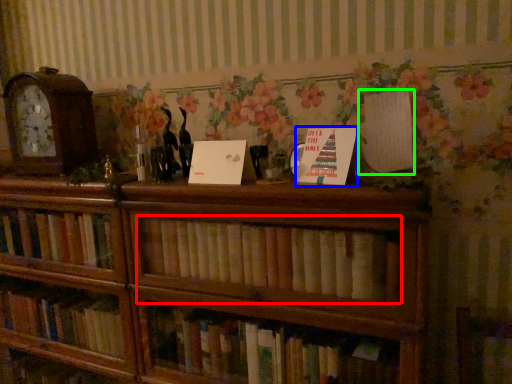
Question: Which object is positioned farthest from book (highlighted by a red box)? Select from paperback book (highlighted by a blue box) and paperback book (highlighted by a green box).

Choices:
 (A) paperback book
 (B) paperback book

Answer: (B)